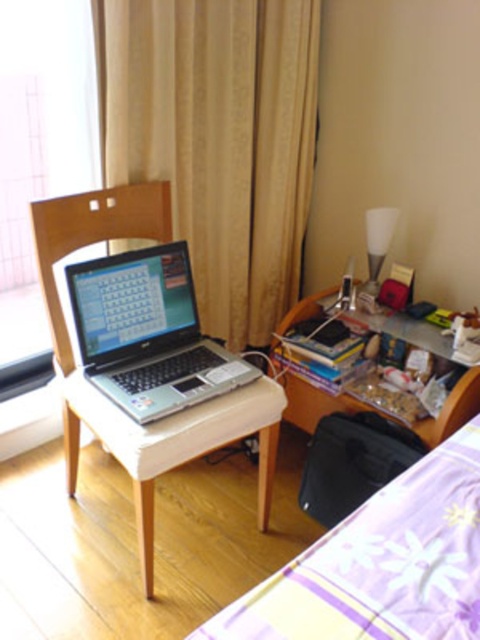
Is the position of beige fabric curtain at upper center more distant than that of wooden desk at right?

No, it is in front of wooden desk at right.

Find the location of a particular element. beige fabric curtain at upper center is located at coordinates (218, 138).

Which is behind, point (300, 132) or point (300, 316)?

Positioned behind is point (300, 132).

This screenshot has width=480, height=640. Find the location of `beige fabric curtain at upper center`. beige fabric curtain at upper center is located at coordinates (218, 138).

Is transparent glass window at left to the right of silver/black laptop at left from the viewer's perspective?

No, transparent glass window at left is not to the right of silver/black laptop at left.

In the scene shown: Does transparent glass window at left have a lesser width compared to silver/black laptop at left?

Correct, transparent glass window at left's width is less than silver/black laptop at left's.

The height and width of the screenshot is (640, 480). What do you see at coordinates (39, 161) in the screenshot? I see `transparent glass window at left` at bounding box center [39, 161].

This screenshot has height=640, width=480. In order to click on transparent glass window at left in this screenshot , I will do `click(39, 161)`.

Can you confirm if wooden chair at center is thinner than silver/black laptop at left?

Incorrect, wooden chair at center's width is not less than silver/black laptop at left's.

Is point (180, 461) closer to camera compared to point (64, 272)?

Yes, it is.

Is point (182, 451) less distant than point (167, 284)?

Yes, point (182, 451) is in front of point (167, 284).

The width and height of the screenshot is (480, 640). I want to click on wooden chair at center, so click(x=96, y=390).